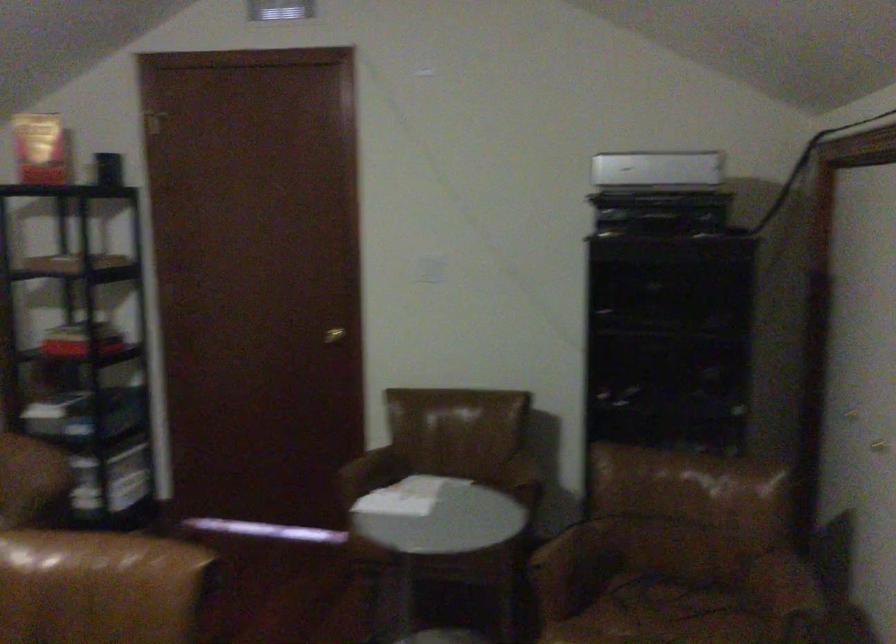
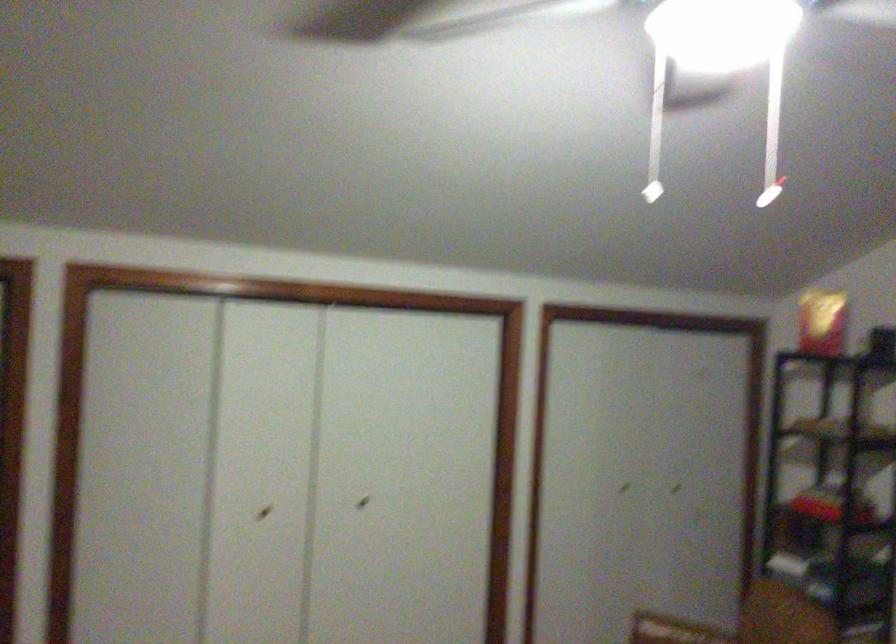
Question: The first image is from the beginning of the video and the second image is from the end. How did the camera likely rotate when shooting the video?

Choices:
 (A) Left
 (B) Right
 (C) Up
 (D) Down

Answer: (A)